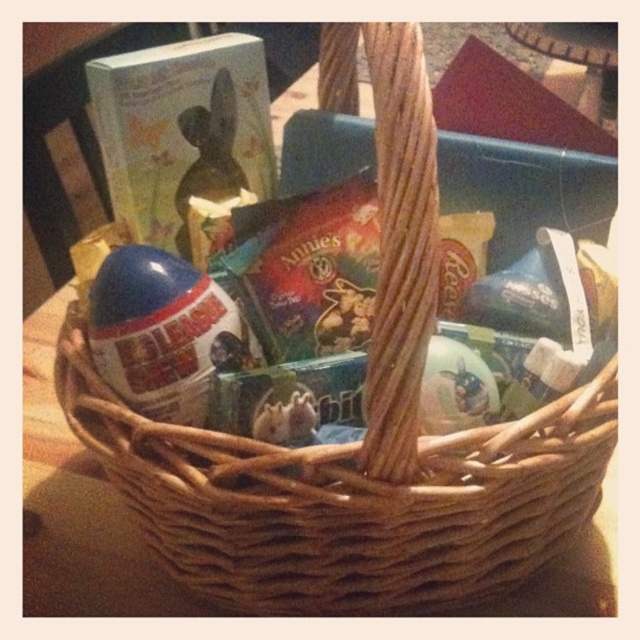
Does blue plastic egg at center lie in front of shiny plastic bunny at center?

Yes, blue plastic egg at center is in front of shiny plastic bunny at center.

Is point (122, 259) farther from viewer compared to point (230, 92)?

No.

Does point (189, 336) lie in front of point (204, 108)?

Yes, it is in front of point (204, 108).

In order to click on blue plastic egg at center in this screenshot , I will do `click(161, 332)`.